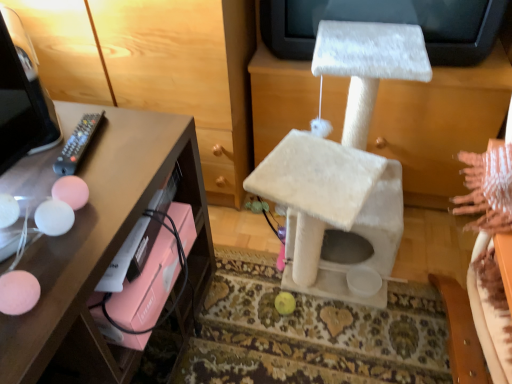
Question: Considering the relative positions of black plastic remote at left and white furry cat tree at center in the image provided, is black plastic remote at left behind white furry cat tree at center?

Choices:
 (A) no
 (B) yes

Answer: (B)

Question: Can you confirm if black plastic remote at left is thinner than white furry cat tree at center?

Choices:
 (A) no
 (B) yes

Answer: (B)

Question: Does black plastic remote at left appear on the right side of white furry cat tree at center?

Choices:
 (A) yes
 (B) no

Answer: (B)

Question: Is black plastic remote at left positioned with its back to white furry cat tree at center?

Choices:
 (A) yes
 (B) no

Answer: (B)

Question: From the image's perspective, is black plastic remote at left over white furry cat tree at center?

Choices:
 (A) no
 (B) yes

Answer: (B)

Question: From a real-world perspective, relative to black plastic remote at left, is matte pink drawer at left vertically above or below?

Choices:
 (A) above
 (B) below

Answer: (B)

Question: Based on their sizes in the image, would you say matte pink drawer at left is bigger or smaller than black plastic remote at left?

Choices:
 (A) small
 (B) big

Answer: (B)

Question: In terms of width, does matte pink drawer at left look wider or thinner when compared to black plastic remote at left?

Choices:
 (A) wide
 (B) thin

Answer: (A)

Question: Considering the positions of matte pink drawer at left and black plastic remote at left in the image, is matte pink drawer at left taller or shorter than black plastic remote at left?

Choices:
 (A) short
 (B) tall

Answer: (B)

Question: Is black plastic remote at left bigger or smaller than white furry cat tree at center?

Choices:
 (A) big
 (B) small

Answer: (B)

Question: From a real-world perspective, relative to white furry cat tree at center, is black plastic remote at left vertically above or below?

Choices:
 (A) above
 (B) below

Answer: (A)

Question: Do you think black plastic remote at left is within white furry cat tree at center, or outside of it?

Choices:
 (A) inside
 (B) outside

Answer: (B)

Question: In the image, is black plastic remote at left on the left side or the right side of white furry cat tree at center?

Choices:
 (A) left
 (B) right

Answer: (A)

Question: In the image, is matte pink drawer at left positioned in front of or behind white furry cat tree at center?

Choices:
 (A) front
 (B) behind

Answer: (B)

Question: Is point (134, 72) closer or farther from the camera than point (361, 31)?

Choices:
 (A) closer
 (B) farther

Answer: (B)